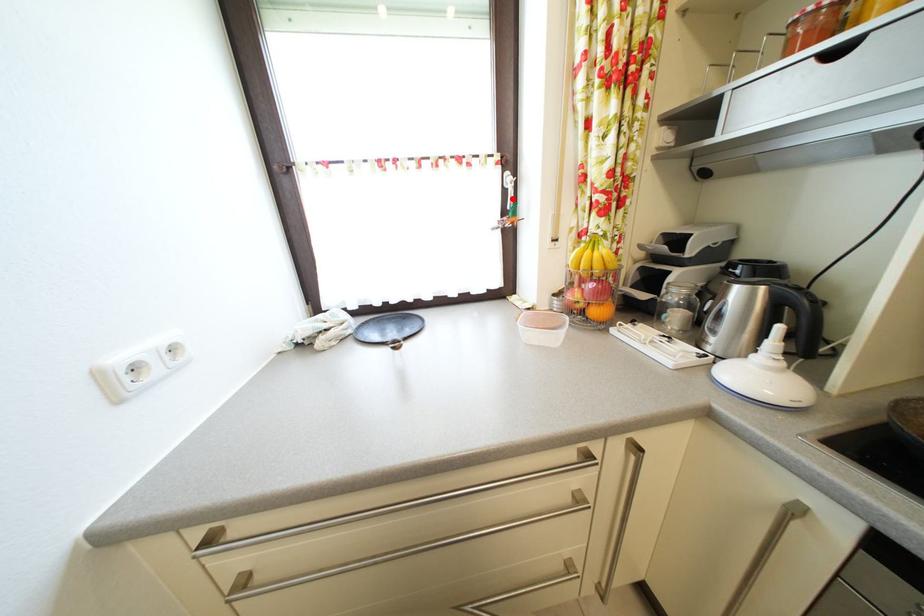
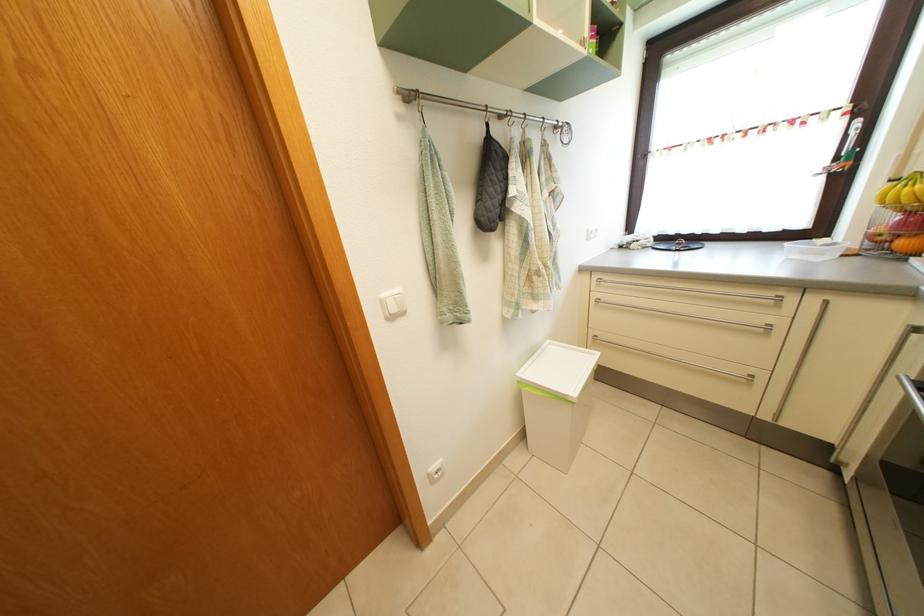
Question: I am providing you with two images of the same scene from different viewpoints. Given a red point in image1, look at the same physical point in image2. Is it:

Choices:
 (A) Closer to the viewpoint
 (B) Farther from the viewpoint

Answer: (B)